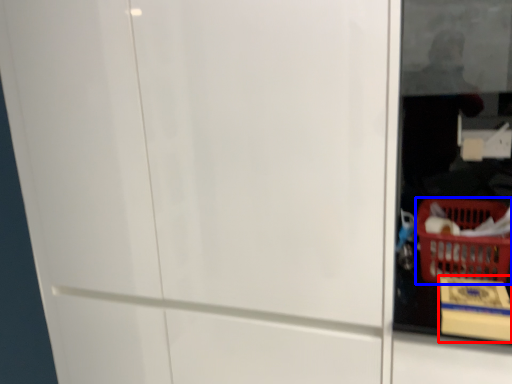
Question: Which of the following is the closest to the observer, cardboard box (highlighted by a red box) or basket (highlighted by a blue box)?

Choices:
 (A) cardboard box
 (B) basket

Answer: (A)